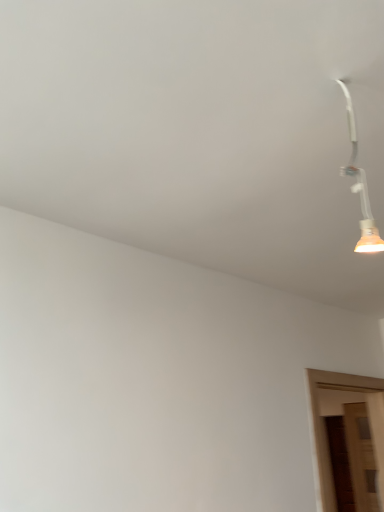
Describe the element at coordinates (360, 186) in the screenshot. I see `white plastic lamp at upper right` at that location.

I want to click on white plastic lamp at upper right, so click(360, 186).

Image resolution: width=384 pixels, height=512 pixels. In order to click on wooden door at lower right in this screenshot , I will do `click(324, 429)`.

Image resolution: width=384 pixels, height=512 pixels. Describe the element at coordinates (324, 429) in the screenshot. I see `wooden door at lower right` at that location.

Where is `white plastic lamp at upper right`? white plastic lamp at upper right is located at coordinates (360, 186).

Which object is positioned more to the right, wooden door at lower right or white plastic lamp at upper right?

wooden door at lower right.

Is wooden door at lower right in front of or behind white plastic lamp at upper right in the image?

Visually, wooden door at lower right is located behind white plastic lamp at upper right.

Does point (322, 439) come in front of point (346, 91)?

No, it is behind (346, 91).

Looking at this image, from the image's perspective, is wooden door at lower right on white plastic lamp at upper right?

Incorrect, from the image's perspective, wooden door at lower right is lower than white plastic lamp at upper right.

From a real-world perspective, which object stands above the other?

white plastic lamp at upper right is physically above.

Is wooden door at lower right wider than white plastic lamp at upper right?

Yes.

Considering the sizes of objects wooden door at lower right and white plastic lamp at upper right in the image provided, who is shorter, wooden door at lower right or white plastic lamp at upper right?

white plastic lamp at upper right.

Between wooden door at lower right and white plastic lamp at upper right, which one has larger size?

wooden door at lower right is bigger.

Is wooden door at lower right inside the boundaries of white plastic lamp at upper right, or outside?

wooden door at lower right is outside white plastic lamp at upper right.

Is wooden door at lower right next to white plastic lamp at upper right and touching it?

No, wooden door at lower right is not next to white plastic lamp at upper right.

Is wooden door at lower right turned away from white plastic lamp at upper right?

No, wooden door at lower right is not facing the opposite direction of white plastic lamp at upper right.

What's the angular difference between wooden door at lower right and white plastic lamp at upper right's facing directions?

There is a 180-degree angle between the facing directions of wooden door at lower right and white plastic lamp at upper right.

Locate an element on the screen. This screenshot has height=512, width=384. door below the white plastic lamp at upper right (from a real-world perspective) is located at coordinates (324, 429).

Based on the photo, which object is positioned more to the right, white plastic lamp at upper right or wooden door at lower right?

Positioned to the right is wooden door at lower right.

Does white plastic lamp at upper right lie behind wooden door at lower right?

No, white plastic lamp at upper right is closer to the viewer.

Which point is more distant from viewer, (375, 232) or (325, 459)?

Positioned behind is point (325, 459).

From the image's perspective, is white plastic lamp at upper right located above or below wooden door at lower right?

From the image's perspective, white plastic lamp at upper right appears above wooden door at lower right.

From a real-world perspective, is white plastic lamp at upper right physically above wooden door at lower right?

Indeed, from a real-world perspective, white plastic lamp at upper right stands above wooden door at lower right.

Which of these two, white plastic lamp at upper right or wooden door at lower right, is wider?

Wider between the two is wooden door at lower right.

Which of these two, white plastic lamp at upper right or wooden door at lower right, stands shorter?

white plastic lamp at upper right is shorter.

Between white plastic lamp at upper right and wooden door at lower right, which one has larger size?

With larger size is wooden door at lower right.

Can we say white plastic lamp at upper right lies outside wooden door at lower right?

white plastic lamp at upper right lies outside wooden door at lower right's area.

Would you consider white plastic lamp at upper right to be distant from wooden door at lower right?

Absolutely, white plastic lamp at upper right is distant from wooden door at lower right.

Is wooden door at lower right at the back of white plastic lamp at upper right?

No, wooden door at lower right is not at the back of white plastic lamp at upper right.

Can you tell me how much white plastic lamp at upper right and wooden door at lower right differ in facing direction?

The facing directions of white plastic lamp at upper right and wooden door at lower right are 180 degrees apart.

In order to click on lamp that is above the wooden door at lower right (from a real-world perspective) in this screenshot , I will do 360,186.

You are a GUI agent. You are given a task and a screenshot of the screen. Output one action in this format:
    pyautogui.click(x=<x>, y=<y>)
    Task: Click on the door on the right of the white plastic lamp at upper right
    This screenshot has width=384, height=512.
    Given the screenshot: What is the action you would take?
    tap(324, 429)

Find the location of `door below the white plastic lamp at upper right (from a real-world perspective)`. door below the white plastic lamp at upper right (from a real-world perspective) is located at coordinates (324, 429).